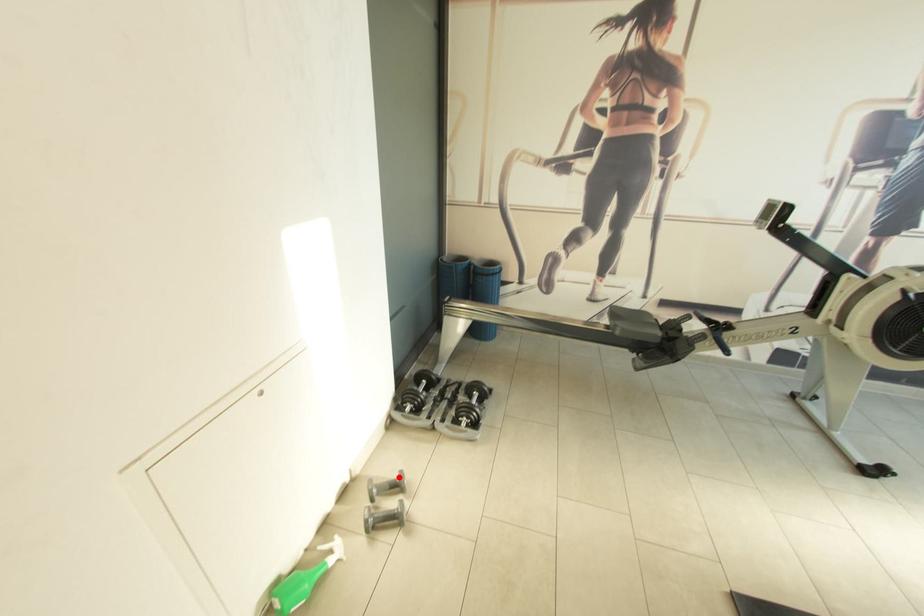
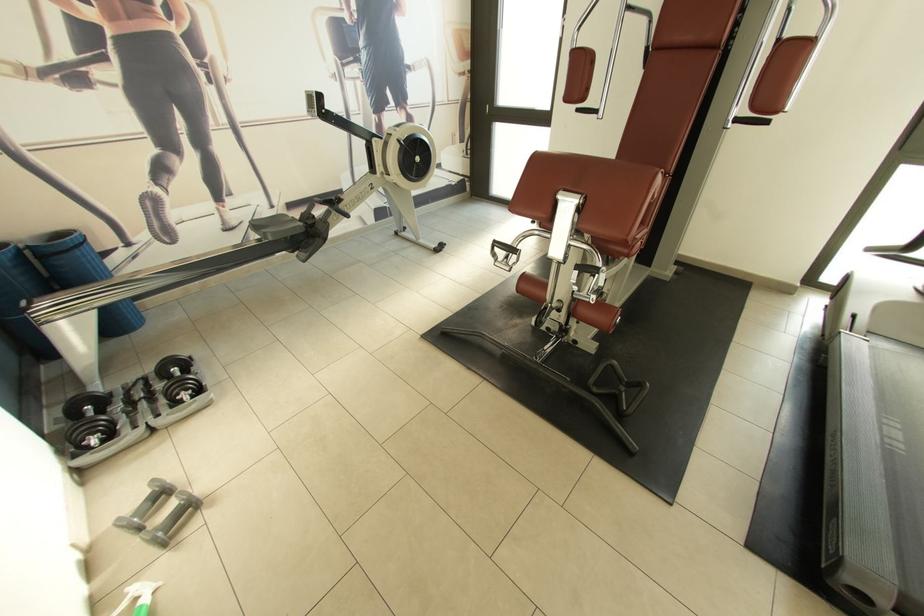
Question: I am providing you with two images of the same scene from different viewpoints. Given a red point in image1, look at the same physical point in image2. Is it:

Choices:
 (A) Closer to the viewpoint
 (B) Farther from the viewpoint

Answer: (B)